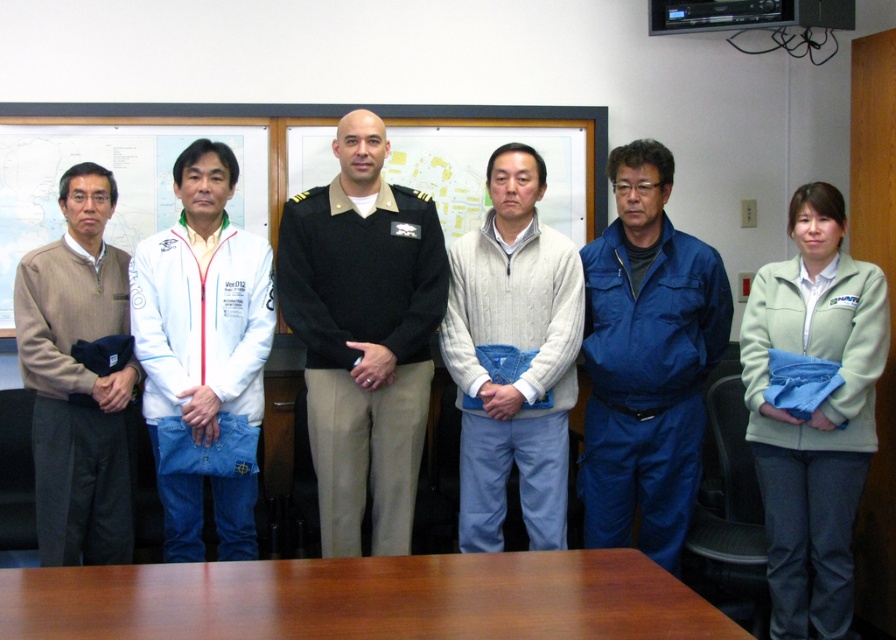
Based on the photo, you are standing in the meeting room and need to hand a document to the person wearing the black uniform at center. To reach them, you must walk past the matte white board at left. Based on their positions, which direction should you move first?

The black uniform at center is to the right of the matte white board at left, so you should move to the right to reach the black uniform at center after passing the matte white board at left.

You are a photographer standing in the room and want to take a photo of the black uniform at center and the matte white board at left. Considering their sizes, which object should you focus on first to ensure both are in frame?

The black uniform at center is much taller than the matte white board at left, so you should focus on the black uniform at center first to ensure both fit in the frame.